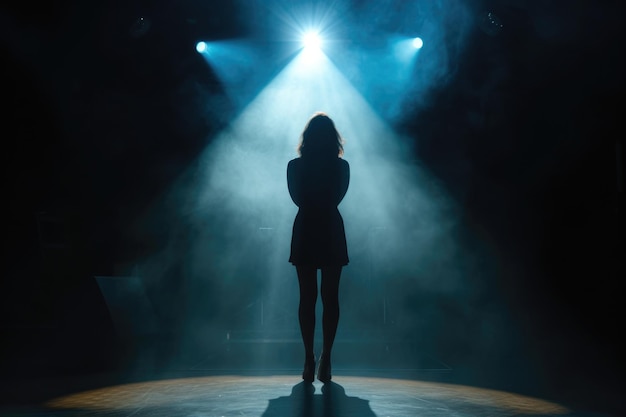
At what (x,y) coordinates should I click in order to perform the action: click on stage. Please return your answer as a coordinate pair (x, y). Looking at the image, I should click on (223, 386).